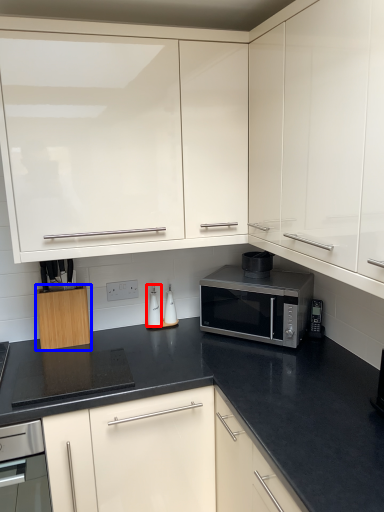
Question: Which of the following is the farthest to the observer, appliance (highlighted by a red box) or cabinetry (highlighted by a blue box)?

Choices:
 (A) appliance
 (B) cabinetry

Answer: (A)